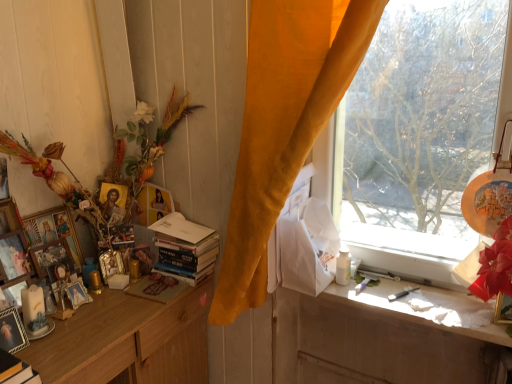
Describe the element at coordinates (143, 147) in the screenshot. I see `wooden textured vase at left` at that location.

At what (x,y) coordinates should I click in order to perform the action: click on smooth golden statue at center. Please return your answer as a coordinate pair (x, y). Looking at the image, I should click on (143, 259).

In order to face matte silver picture frame at lower left, which ranks as the 5th picture frame in left-to-right order, should I rotate leftwards or rightwards?

You should rotate left by 30.284 degrees.

This screenshot has width=512, height=384. What do you see at coordinates (156, 287) in the screenshot?
I see `matte brown magazine at center` at bounding box center [156, 287].

This screenshot has width=512, height=384. What do you see at coordinates (185, 248) in the screenshot? I see `hardcover books at center` at bounding box center [185, 248].

This screenshot has width=512, height=384. What do you see at coordinates (13, 256) in the screenshot?
I see `matte gold picture frame at left, which ranks as the 8th picture frame in right-to-left order` at bounding box center [13, 256].

How much space does matte gold picture frame at left, the 2th picture frame when ordered from left to right, occupy horizontally?

3.30 inches.

Find the location of `wooden picture frame at left, arranged as the fourth picture frame when viewed from the left`. wooden picture frame at left, arranged as the fourth picture frame when viewed from the left is located at coordinates (53, 230).

Which is less distant, (14, 342) or (98, 237)?

Clearly, point (14, 342) is closer to the camera than point (98, 237).

Where is `picture frame that is the 4th one when counting leftward from the wooden textured vase at left`? The height and width of the screenshot is (384, 512). picture frame that is the 4th one when counting leftward from the wooden textured vase at left is located at coordinates (12, 331).

Considering the positions of objects matte silver picture frame at lower left, marked as the 5th picture frame in a right-to-left arrangement, and wooden textured vase at left in the image provided, who is in front, matte silver picture frame at lower left, marked as the 5th picture frame in a right-to-left arrangement, or wooden textured vase at left?

Positioned in front is wooden textured vase at left.

From a real-world perspective, who is located higher, matte silver picture frame at lower left, which ranks as the 5th picture frame in left-to-right order, or wooden textured vase at left?

wooden textured vase at left is physically above.

From a real-world perspective, is transparent glass window at right positioned above or below matte brown magazine at center?

Clearly, from a real-world perspective, transparent glass window at right is above matte brown magazine at center.

Would you say transparent glass window at right is outside matte brown magazine at center?

Yes.

How much distance is there between transparent glass window at right and matte brown magazine at center?

transparent glass window at right is 3.34 feet away from matte brown magazine at center.

What's the angular difference between transparent glass window at right and matte brown magazine at center's facing directions?

transparent glass window at right and matte brown magazine at center are facing 91.2 degrees away from each other.

From a real-world perspective, is matte brown magazine at center physically below silver metallic picture frame at left, arranged as the eighth picture frame when viewed from the left?

Yes, from a real-world perspective, matte brown magazine at center is under silver metallic picture frame at left, arranged as the eighth picture frame when viewed from the left.

Based on their sizes in the image, would you say matte brown magazine at center is bigger or smaller than silver metallic picture frame at left, positioned as the second picture frame in right-to-left order?

matte brown magazine at center is smaller than silver metallic picture frame at left, positioned as the second picture frame in right-to-left order.

Which is more to the right, matte brown magazine at center or silver metallic picture frame at left, positioned as the second picture frame in right-to-left order?

Positioned to the right is matte brown magazine at center.

Is point (350, 276) farther from viewer compared to point (24, 336)?

Yes, point (350, 276) is behind point (24, 336).

From a real-world perspective, which object stands above the other?

white glossy bottle at window.

Considering the sizes of objects white glossy bottle at window and matte silver picture frame at lower left, which ranks as the 5th picture frame in left-to-right order, in the image provided, who is smaller, white glossy bottle at window or matte silver picture frame at lower left, which ranks as the 5th picture frame in left-to-right order,?

Smaller between the two is white glossy bottle at window.

Can you confirm if gold metallic picture frame at upper right, placed as the first picture frame when sorted from right to left, is thinner than matte brown magazine at center?

Correct, the width of gold metallic picture frame at upper right, placed as the first picture frame when sorted from right to left, is less than that of matte brown magazine at center.

Is gold metallic picture frame at upper right, placed as the first picture frame when sorted from right to left, facing towards matte brown magazine at center?

No, gold metallic picture frame at upper right, placed as the first picture frame when sorted from right to left, is not oriented towards matte brown magazine at center.

In the scene shown: Which of these two, gold metallic picture frame at upper right, placed as the first picture frame when sorted from right to left, or matte brown magazine at center, is smaller?

Smaller between the two is matte brown magazine at center.

Are gold metallic picture frame at upper right, the 9th picture frame viewed from the left, and matte brown magazine at center located far from each other?

That's right, there is a large distance between gold metallic picture frame at upper right, the 9th picture frame viewed from the left, and matte brown magazine at center.

Which object is further away from the camera, white glossy bottle at window or gold metallic picture frame at upper right, placed as the first picture frame when sorted from right to left?

white glossy bottle at window is more distant.

From a real-world perspective, who is located lower, white glossy bottle at window or gold metallic picture frame at upper right, the 9th picture frame viewed from the left?

white glossy bottle at window, from a real-world perspective.

Does white glossy bottle at window have a lesser width compared to gold metallic picture frame at upper right, placed as the first picture frame when sorted from right to left?

Indeed, white glossy bottle at window has a lesser width compared to gold metallic picture frame at upper right, placed as the first picture frame when sorted from right to left.

Is matte gold picture frame at left, the 3th picture frame positioned from the left, surrounded by wooden picture frame at left, arranged as the fourth picture frame when viewed from the right?

Definitely not — matte gold picture frame at left, the 3th picture frame positioned from the left, is not inside wooden picture frame at left, arranged as the fourth picture frame when viewed from the right.

Considering the sizes of objects wooden picture frame at left, which appears as the sixth picture frame when viewed from the left, and matte gold picture frame at left, the 3th picture frame positioned from the left, in the image provided, who is taller, wooden picture frame at left, which appears as the sixth picture frame when viewed from the left, or matte gold picture frame at left, the 3th picture frame positioned from the left,?

wooden picture frame at left, which appears as the sixth picture frame when viewed from the left, is taller.

Between point (55, 258) and point (24, 281), which one is positioned behind?

Point (55, 258)

From a real-world perspective, which object stands above the other?

wooden picture frame at left, which appears as the sixth picture frame when viewed from the left.

This screenshot has width=512, height=384. Identify the location of floral arrangement in front of the matte silver picture frame at lower left, marked as the 5th picture frame in a right-to-left arrangement. (143, 147).

Where is `magazine behind the transparent glass window at right`? magazine behind the transparent glass window at right is located at coordinates (156, 287).

From the image, which object appears to be farther from smooth golden statue at center, matte gold picture frame at left, the 2th picture frame when ordered from left to right, or hardcover books at center?

matte gold picture frame at left, the 2th picture frame when ordered from left to right, lies further to smooth golden statue at center than the other object.

From the picture: Looking at the image, which one is located further to matte gold picture frame at left, the 3th picture frame positioned from the left, smooth golden statue at center or wooden picture frame at left, arranged as the fourth picture frame when viewed from the right?

smooth golden statue at center lies further to matte gold picture frame at left, the 3th picture frame positioned from the left, than the other object.

Looking at the image, which one is located closer to white paper bag at right, wooden picture frame at left, arranged as the fourth picture frame when viewed from the right, or matte brown magazine at center?

matte brown magazine at center lies closer to white paper bag at right than the other object.

Estimate the real-world distances between objects in this image. Which object is further from white paper bag at right, hardcover books at center or gold leaf picture frame at upper left, which ranks as the 7th picture frame in left-to-right order?

gold leaf picture frame at upper left, which ranks as the 7th picture frame in left-to-right order, is further to white paper bag at right.

Which object lies further to the anchor point silver metallic picture frame at left, positioned as the second picture frame in right-to-left order, smooth golden statue at center or gold metallic picture frame at upper right, placed as the first picture frame when sorted from right to left?

gold metallic picture frame at upper right, placed as the first picture frame when sorted from right to left, lies further to silver metallic picture frame at left, positioned as the second picture frame in right-to-left order, than the other object.

From the image, which object appears to be farther from gold metallic picture frame at upper right, placed as the first picture frame when sorted from right to left, white paper bag at right or matte silver picture frame at lower left, marked as the 5th picture frame in a right-to-left arrangement?

The object further to gold metallic picture frame at upper right, placed as the first picture frame when sorted from right to left, is matte silver picture frame at lower left, marked as the 5th picture frame in a right-to-left arrangement.

When comparing their distances from wooden picture frame at left, arranged as the fourth picture frame when viewed from the left, does smooth golden statue at center or gold leaf picture frame at upper left, which ranks as the 7th picture frame in left-to-right order, seem further?

Based on the image, smooth golden statue at center appears to be further to wooden picture frame at left, arranged as the fourth picture frame when viewed from the left.

Based on their spatial positions, is wooden picture frame at left, which appears as the sixth picture frame when viewed from the left, or transparent glass window at right further from matte gold picture frame at left, the 2th picture frame when ordered from left to right?

transparent glass window at right lies further to matte gold picture frame at left, the 2th picture frame when ordered from left to right, than the other object.

Where is `magazine between wooden picture frame at left, arranged as the fourth picture frame when viewed from the left, and wooden cabinet at left, in the vertical direction`? The height and width of the screenshot is (384, 512). magazine between wooden picture frame at left, arranged as the fourth picture frame when viewed from the left, and wooden cabinet at left, in the vertical direction is located at coordinates tap(156, 287).

The image size is (512, 384). Identify the location of magazine between wooden cabinet at left and silver metallic picture frame at left, positioned as the second picture frame in right-to-left order, along the z-axis. (156, 287).

Find the location of `magazine between matte gold picture frame at left, marked as the 7th picture frame in a right-to-left arrangement, and hardcover books at center from left to right`. magazine between matte gold picture frame at left, marked as the 7th picture frame in a right-to-left arrangement, and hardcover books at center from left to right is located at coordinates (156, 287).

The image size is (512, 384). Find the location of `magazine between gold leaf picture frame at upper left, which ranks as the 7th picture frame in left-to-right order, and white paper bag at right`. magazine between gold leaf picture frame at upper left, which ranks as the 7th picture frame in left-to-right order, and white paper bag at right is located at coordinates [x=156, y=287].